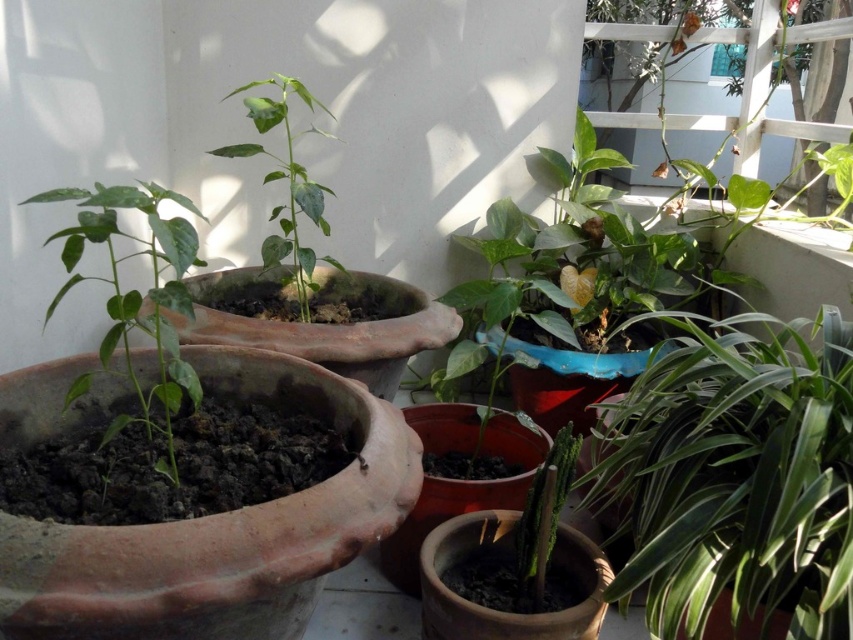
You are standing on the balcony and want to water the green matte plant at left and the green matte plant at center. Which plant do you need to water first if you want to water the one closer to you first?

The green matte plant at left is in front of the green matte plant at center, so you should water the green matte plant at left first since it is closer to you.

You are standing on the balcony looking at the green glossy leafy plant at center right. There is a point marked at coordinates [735,477]. Where is this point located?

The point at coordinates [735,477] is located on the green glossy leafy plant at center right.